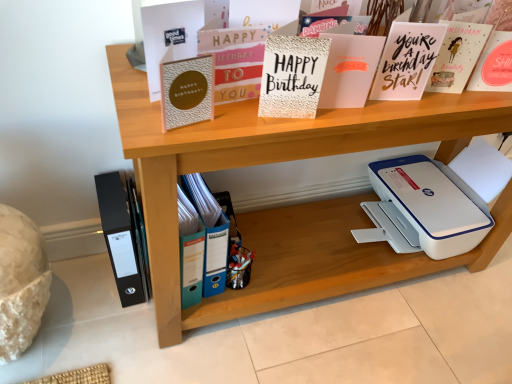
Find the location of a particular element. Image resolution: width=512 pixels, height=384 pixels. vacant area that lies to the right of textured gold card at center, which ranks as the fourth paperback book in left-to-right order is located at coordinates click(x=359, y=117).